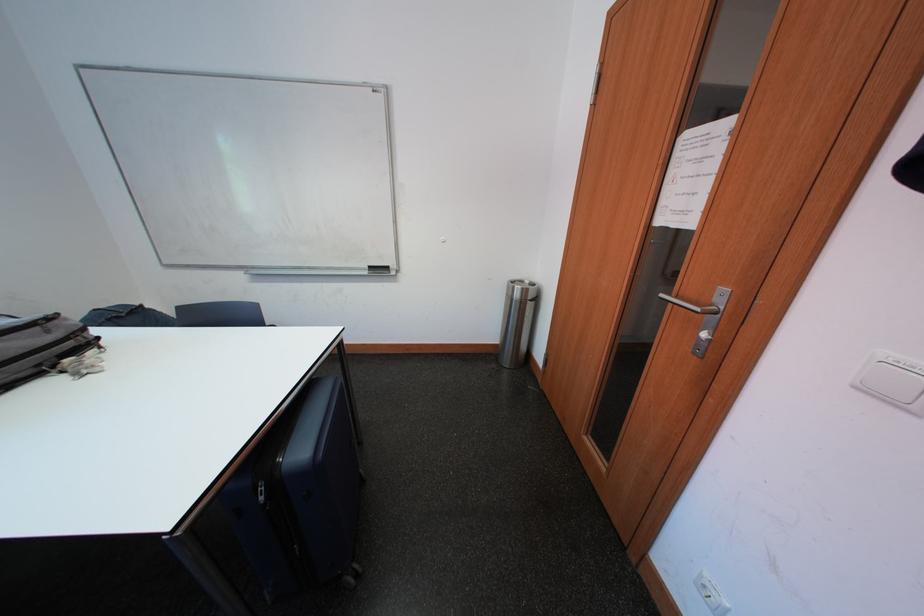
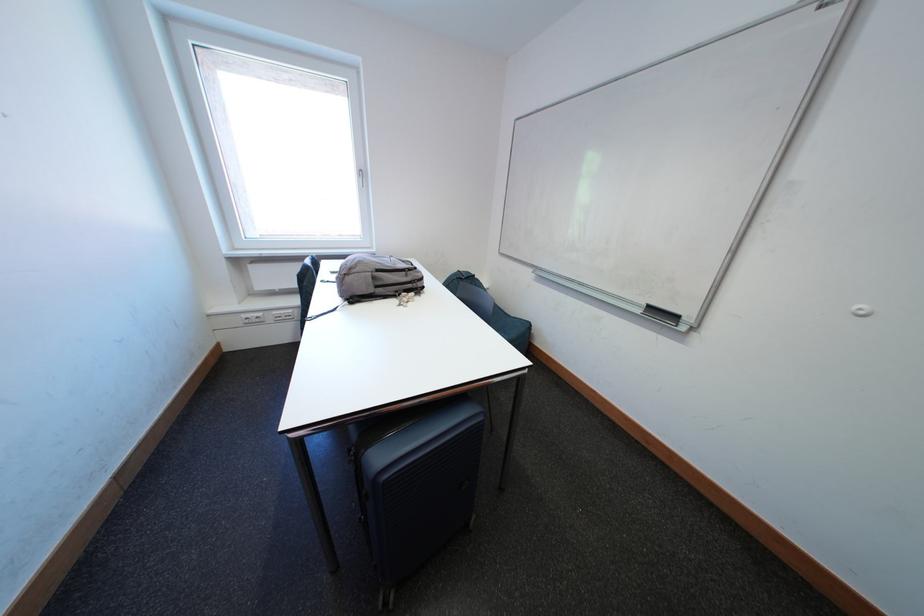
The point at (375, 276) is marked in the first image. Where is the corresponding point in the second image?

(649, 315)